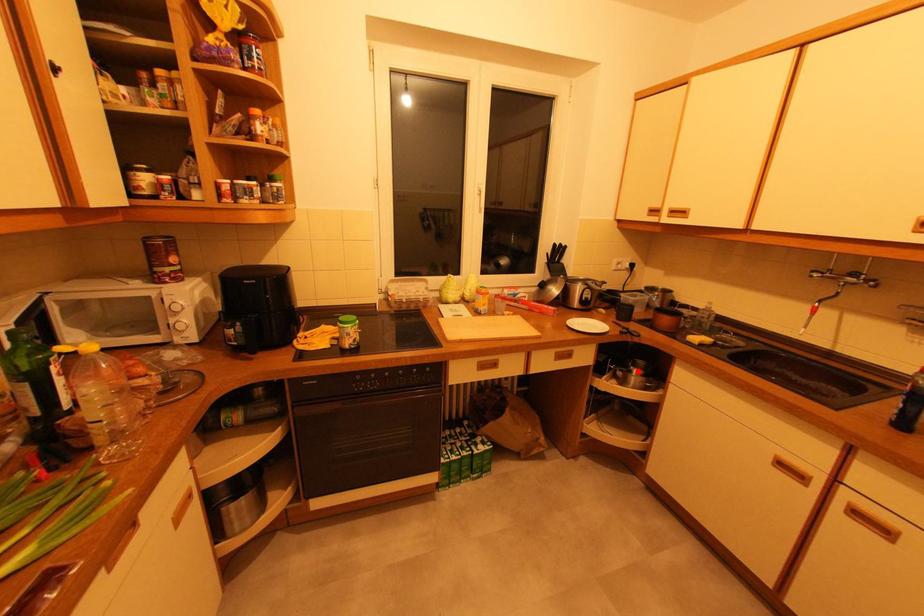
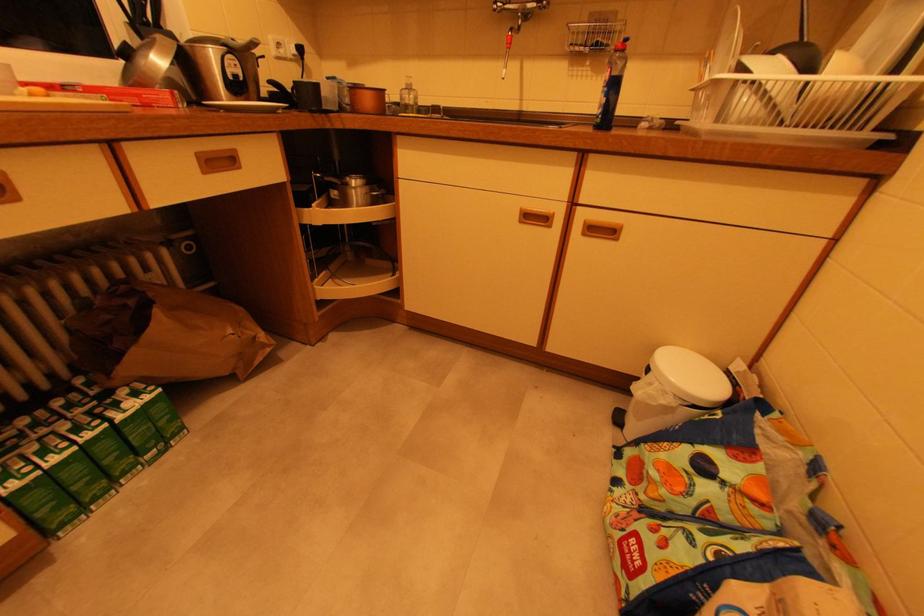
Question: I am providing you with two images of the same scene from different viewpoints. A red point is shown in image1. For the corresponding object point in image2, is it positioned nearer or farther from the camera?

Choices:
 (A) Nearer
 (B) Farther

Answer: (A)